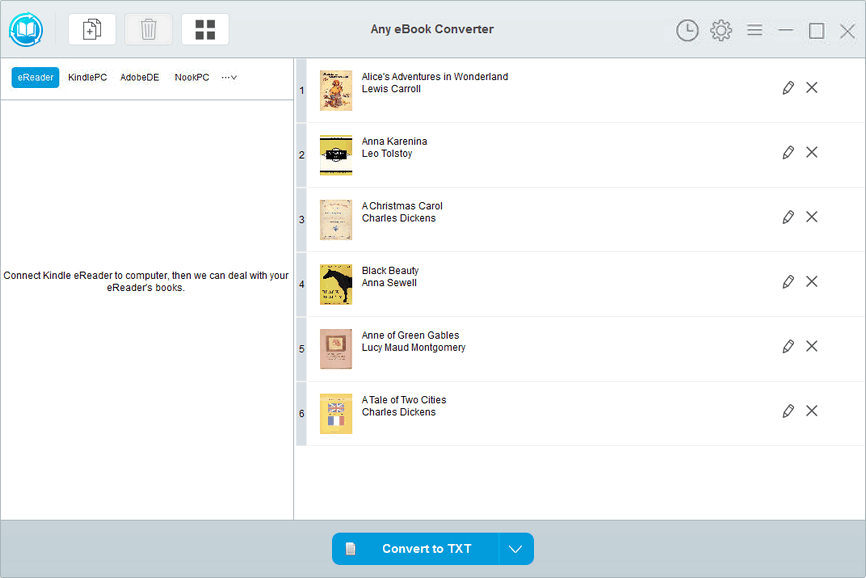
This screenshot has height=578, width=866. I want to click on ebook, so click(340, 153).